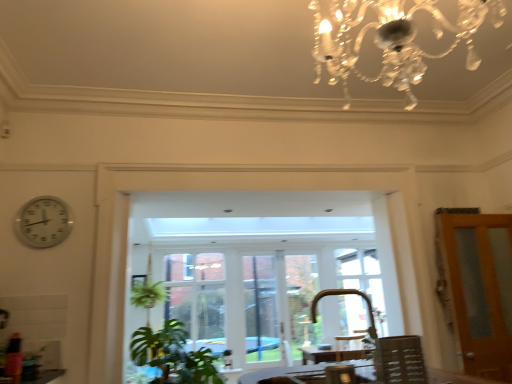
Describe the element at coordinates (277, 372) in the screenshot. I see `wooden table at lower center` at that location.

Where is `white plastic clock at left`? The width and height of the screenshot is (512, 384). white plastic clock at left is located at coordinates (42, 222).

What is the approximate height of clear glass window at center?

clear glass window at center is 5.80 feet tall.

The image size is (512, 384). I want to click on green leafy plant at lower left, so click(173, 356).

Where is `wooden table at lower center`? wooden table at lower center is located at coordinates (277, 372).

Looking at this image, how many degrees apart are the facing directions of wooden chair at lower right and clear glass window at center?

They differ by 177 degrees in their facing directions.

Image resolution: width=512 pixels, height=384 pixels. I want to click on chair that is under the clear glass window at center (from a real-world perspective), so click(400, 360).

Between wooden chair at lower right and clear glass window at center, which one has less height?

wooden chair at lower right.

From the picture: Is wooden chair at lower right spatially inside clear glass window at center, or outside of it?

wooden chair at lower right is outside clear glass window at center.

From a real-world perspective, is white wood window frame at center physically above brown wooden door at right?

No, from a real-world perspective, white wood window frame at center is not above brown wooden door at right.

Looking at this image, considering the sizes of white wood window frame at center and brown wooden door at right in the image, is white wood window frame at center wider or thinner than brown wooden door at right?

Considering their sizes, white wood window frame at center looks slimmer than brown wooden door at right.

Is point (264, 297) farther from camera compared to point (463, 350)?

Yes, point (264, 297) is behind point (463, 350).

Is white wood window frame at center shorter than brown wooden door at right?

No.

Consider the image. How many degrees apart are the facing directions of green leafy plant at lower left and wooden table at lower center?

There is a 92.9-degree angle between the facing directions of green leafy plant at lower left and wooden table at lower center.

Is green leafy plant at lower left facing away from wooden table at lower center?

No.

Which is behind, point (150, 346) or point (429, 373)?

The point (150, 346) is farther from the camera.

Which object is more forward, green leafy plant at lower left or wooden table at lower center?

wooden table at lower center.

Is clear glass window at center spatially inside brown wooden door at right, or outside of it?

clear glass window at center lies outside brown wooden door at right.

From the image's perspective, is clear glass window at center over brown wooden door at right?

No.

Is gold metallic faucet at lower center to the left of wooden table at lower center from the viewer's perspective?

No.

Consider the image. Would you say gold metallic faucet at lower center is a long distance from wooden table at lower center?

Yes, gold metallic faucet at lower center is far from wooden table at lower center.

Where is `faucet behind the wooden table at lower center`? This screenshot has width=512, height=384. faucet behind the wooden table at lower center is located at coordinates (345, 294).

From the image's perspective, is gold metallic faucet at lower center positioned above or below wooden table at lower center?

Clearly, from the image's perspective, gold metallic faucet at lower center is above wooden table at lower center.

From the image's perspective, is clear glass window at center on top of wooden table at lower center?

No, from the image's perspective, clear glass window at center is not on top of wooden table at lower center.

From a real-world perspective, which is physically below, clear glass window at center or wooden table at lower center?

In real-world perspective, wooden table at lower center is lower.

How many degrees apart are the facing directions of clear glass window at center and wooden table at lower center?

They differ by 177 degrees in their facing directions.

At what (x,y) coordinates should I click in order to perform the action: click on table located underneath the clear glass window at center (from a real-world perspective). Please return your answer as a coordinate pair (x, y). The height and width of the screenshot is (384, 512). Looking at the image, I should click on (277, 372).

Which point is more forward, (287, 356) or (450, 377)?

Positioned in front is point (450, 377).

Is white wood window frame at center taller than wooden table at lower center?

Correct, white wood window frame at center is much taller as wooden table at lower center.

This screenshot has width=512, height=384. Identify the location of table in front of the white wood window frame at center. (277, 372).

Image resolution: width=512 pixels, height=384 pixels. I want to click on chair lying on the right of clear glass window at center, so click(400, 360).

At what (x,y) coordinates should I click in order to perform the action: click on door in front of the white wood window frame at center. Please return your answer as a coordinate pair (x, y). The image size is (512, 384). Looking at the image, I should click on (479, 289).

When comparing their distances from white wood window frame at center, does green leafy plant at lower left or wooden table at lower center seem closer?

Among the two, green leafy plant at lower left is located nearer to white wood window frame at center.

From the image, which object appears to be farther from clear glass window at center, white plastic clock at left or brown wooden door at right?

brown wooden door at right lies further to clear glass window at center than the other object.

Looking at the image, which one is located closer to white wood window frame at center, brown wooden door at right or wooden table at lower center?

brown wooden door at right is closer to white wood window frame at center.

Considering their positions, is gold metallic faucet at lower center positioned closer to wooden chair at lower right than wooden table at lower center?

wooden table at lower center is closer to wooden chair at lower right.

When comparing their distances from brown wooden door at right, does clear glass window at center or white wood window frame at center seem further?

clear glass window at center is further to brown wooden door at right.

Estimate the real-world distances between objects in this image. Which object is closer to brown wooden door at right, wooden chair at lower right or white plastic clock at left?

wooden chair at lower right lies closer to brown wooden door at right than the other object.

Based on the photo, from the image, which object appears to be farther from green leafy plant at lower left, brown wooden door at right or white plastic clock at left?

Based on the image, brown wooden door at right appears to be further to green leafy plant at lower left.

From the image, which object appears to be farther from white plastic clock at left, wooden chair at lower right or green leafy plant at lower left?

wooden chair at lower right.

Locate an element on the screen. The image size is (512, 384). faucet between wooden table at lower center and green leafy plant at lower left in the front-back direction is located at coordinates (345, 294).

Find the location of `faucet between wooden chair at lower right and green leafy plant at lower left in the front-back direction`. faucet between wooden chair at lower right and green leafy plant at lower left in the front-back direction is located at coordinates (345, 294).

Identify the location of chair between wooden table at lower center and clear glass window at center along the z-axis. (400, 360).

Where is `window located between white plastic clock at left and brown wooden door at right in the left-right direction`? window located between white plastic clock at left and brown wooden door at right in the left-right direction is located at coordinates (197, 297).